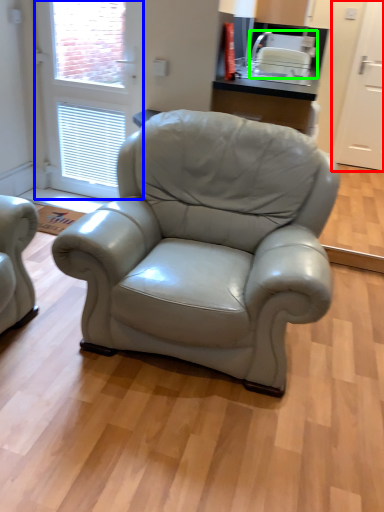
Question: Considering the real-world distances, which object is farthest from screen door (highlighted by a red box)? screen door (highlighted by a blue box) or appliance (highlighted by a green box)?

Choices:
 (A) screen door
 (B) appliance

Answer: (A)